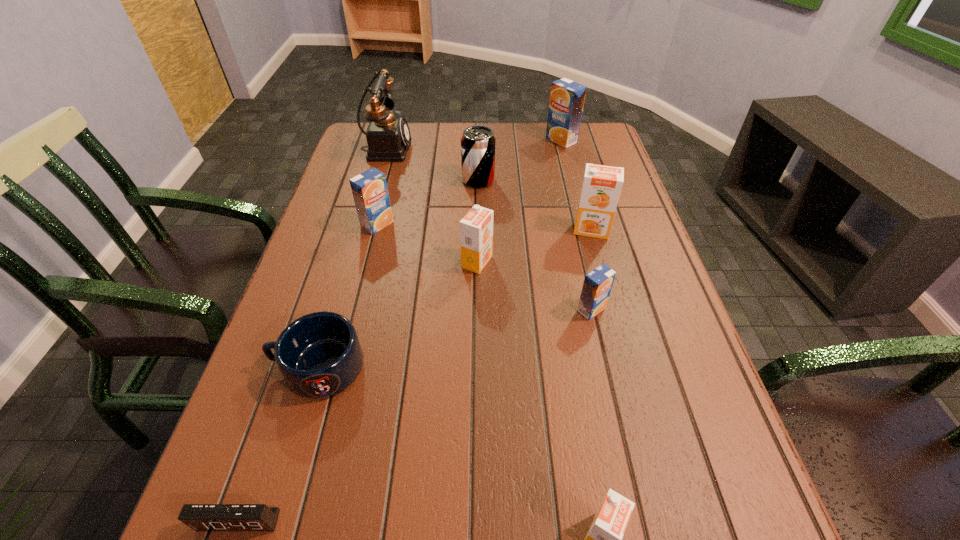
Find the location of a particular element. the tallest object is located at coordinates (388, 136).

Identify the location of gray telephone. (388, 136).

Where is `the biggest blue orange_juice`? the biggest blue orange_juice is located at coordinates pos(567,97).

Find the location of `the farthest blue orange_juice`. the farthest blue orange_juice is located at coordinates [x=567, y=97].

Find the location of a particular element. the rightmost orange orange juice is located at coordinates (601, 188).

Image resolution: width=960 pixels, height=540 pixels. I want to click on the biggest orange orange juice, so click(601, 188).

At what (x,y) coordinates should I click in order to perform the action: click on the third farthest object. Please return your answer as a coordinate pair (x, y). This screenshot has height=540, width=960. Looking at the image, I should click on (477, 143).

Locate an element on the screen. This screenshot has height=540, width=960. the leftmost orange juice is located at coordinates (370, 192).

Locate an element on the screen. the leftmost blue orange_juice is located at coordinates pos(370,192).

Locate an element on the screen. the fifth nearest object is located at coordinates (476, 228).